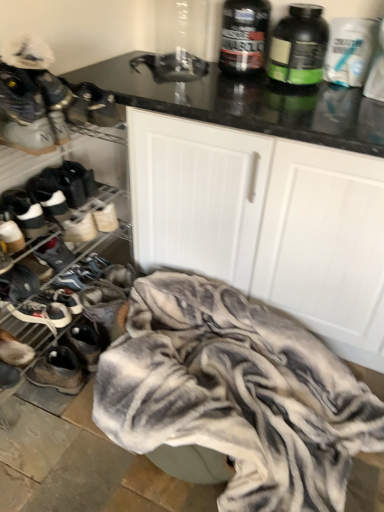
The width and height of the screenshot is (384, 512). In order to click on free location to the right of black matte protein powder container at upper right, acting as the 2th bottle starting from the left in this screenshot , I will do (x=341, y=92).